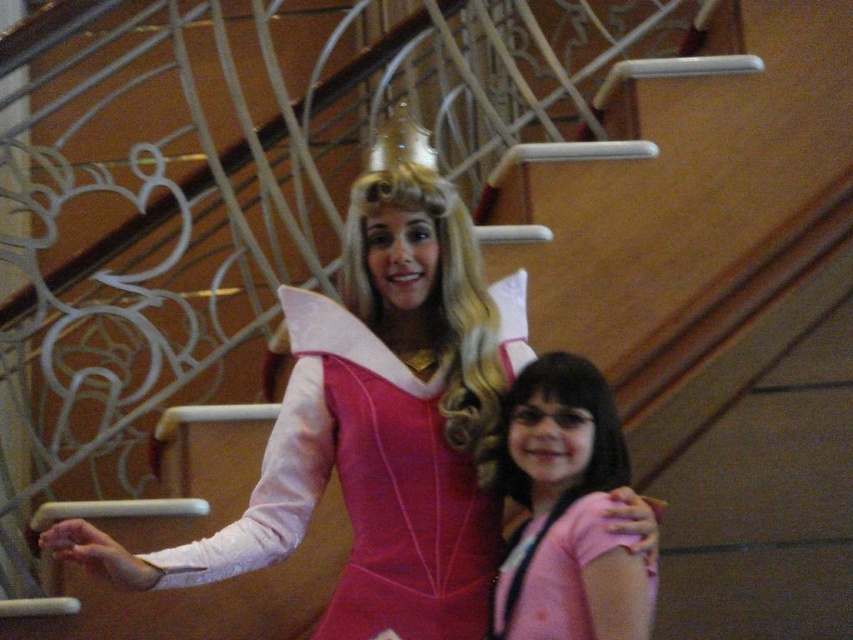
Question: Among these points, which one is nearest to the camera?

Choices:
 (A) (561, 532)
 (B) (213, 566)

Answer: (A)

Question: Does satin pink dress at center appear on the right side of pink fabric at center?

Choices:
 (A) yes
 (B) no

Answer: (B)

Question: Is satin pink dress at center above pink fabric at center?

Choices:
 (A) yes
 (B) no

Answer: (A)

Question: Does satin pink dress at center have a smaller size compared to pink fabric at center?

Choices:
 (A) yes
 (B) no

Answer: (B)